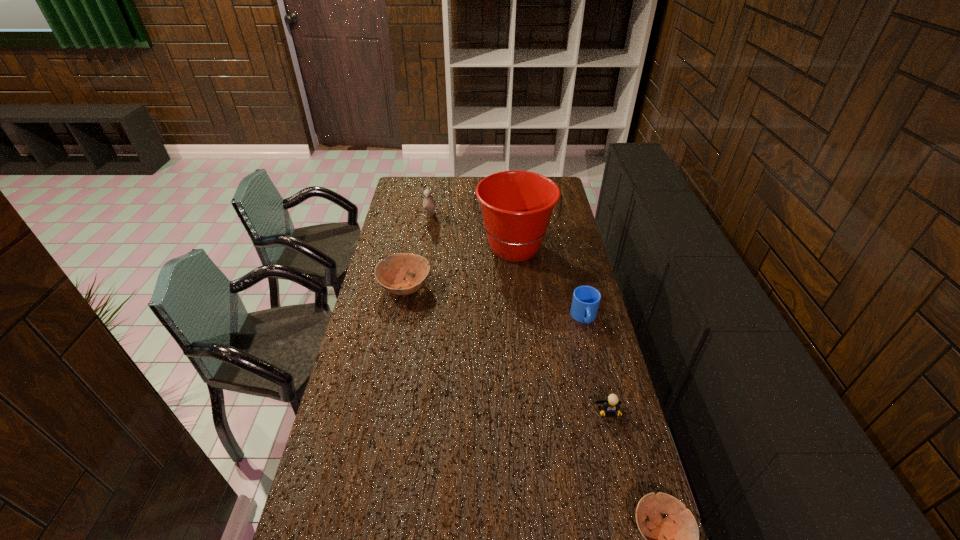
The image size is (960, 540). What are the coordinates of `blank area located with the handle attached to the rim of the tallest object` in the screenshot? It's located at (521, 316).

At what (x,y) coordinates should I click in order to perform the action: click on vacant area situated on the front-facing side of the second nearest object. Please return your answer as a coordinate pair (x, y). The height and width of the screenshot is (540, 960). Looking at the image, I should click on (632, 508).

Identify the location of object at the left edge. This screenshot has width=960, height=540. (391, 278).

This screenshot has height=540, width=960. I want to click on mug at the right edge, so click(x=586, y=299).

You are a GUI agent. You are given a task and a screenshot of the screen. Output one action in this format:
    pyautogui.click(x=<x>, y=<y>)
    Task: Click on the bucket positioned at the right edge
    The width and height of the screenshot is (960, 540).
    Given the screenshot: What is the action you would take?
    pyautogui.click(x=516, y=205)

Where is `Lego positioned at the right edge`? Image resolution: width=960 pixels, height=540 pixels. Lego positioned at the right edge is located at coordinates (610, 406).

Identify the location of free space at the near edge. (410, 532).

Find the location of a particular element. The width and height of the screenshot is (960, 540). free space at the left edge of the desktop is located at coordinates (349, 395).

You are a GUI agent. You are given a task and a screenshot of the screen. Output one action in this format:
    pyautogui.click(x=<x>, y=<y>)
    Task: Click on the blank area at the right edge
    
    Given the screenshot: What is the action you would take?
    pyautogui.click(x=572, y=268)

Where is `vacant space at the far left corner of the desktop`? The width and height of the screenshot is (960, 540). vacant space at the far left corner of the desktop is located at coordinates (423, 193).